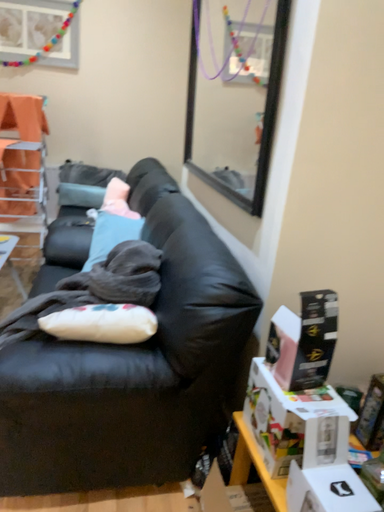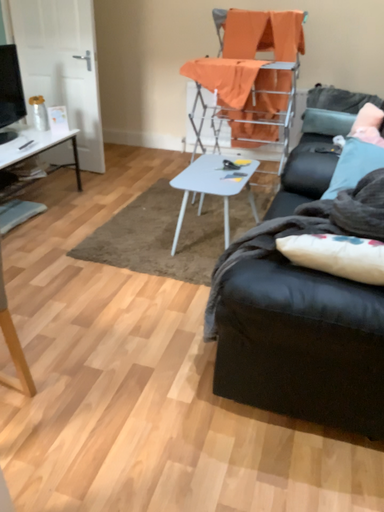
Question: Which way did the camera rotate in the video?

Choices:
 (A) rotated left
 (B) rotated right

Answer: (A)